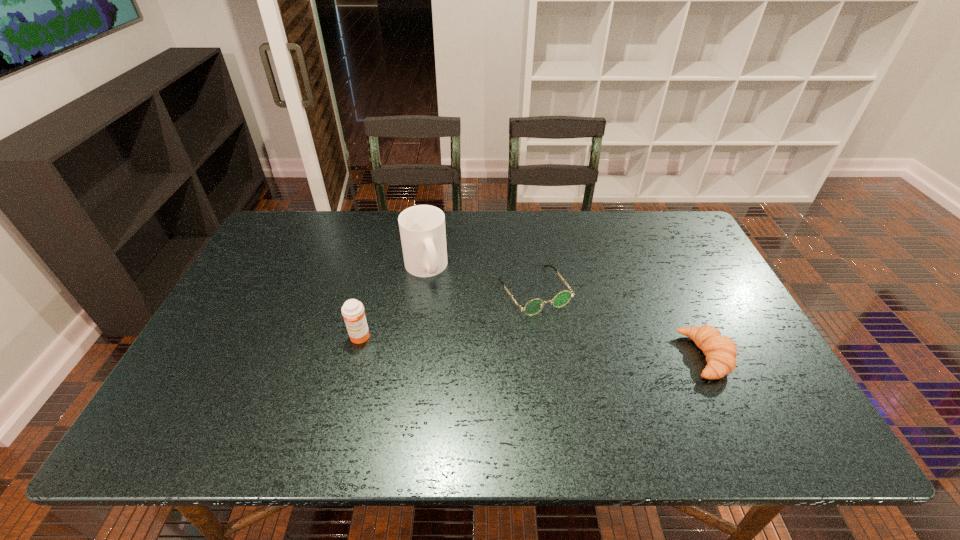
Identify the location of empty location between the crescent roll and the second object from right to left. Image resolution: width=960 pixels, height=540 pixels. 620,323.

Where is `free area in between the spectacles and the second object from left to right`? The height and width of the screenshot is (540, 960). free area in between the spectacles and the second object from left to right is located at coordinates (480, 279).

Find the location of a particular element. This screenshot has height=540, width=960. free space between the crescent roll and the mug is located at coordinates (565, 312).

Identify the location of vacant space in between the mug and the crescent roll. Image resolution: width=960 pixels, height=540 pixels. (565, 312).

Locate an element on the screen. The image size is (960, 540). object that is the closest to the spectacles is located at coordinates coord(422,228).

Locate an element on the screen. This screenshot has width=960, height=540. object that is the closest to the second tallest object is located at coordinates (422, 228).

This screenshot has height=540, width=960. I want to click on free spot that satisfies the following two spatial constraints: 1. on the back side of the third object from left to right; 2. on the right side of the leftmost object, so click(372, 291).

I want to click on vacant area in the image that satisfies the following two spatial constraints: 1. on the front side of the spectacles; 2. on the right side of the crescent roll, so click(x=543, y=356).